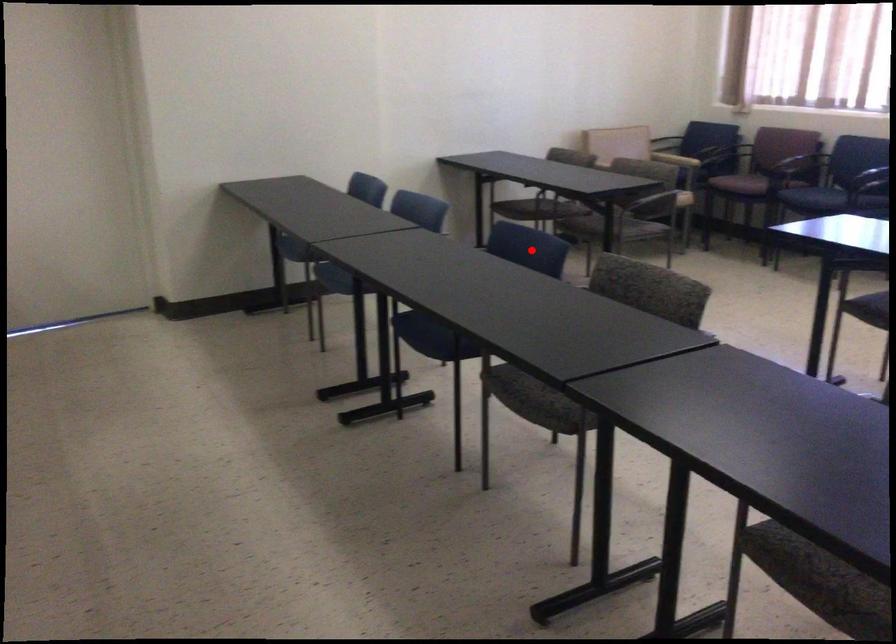
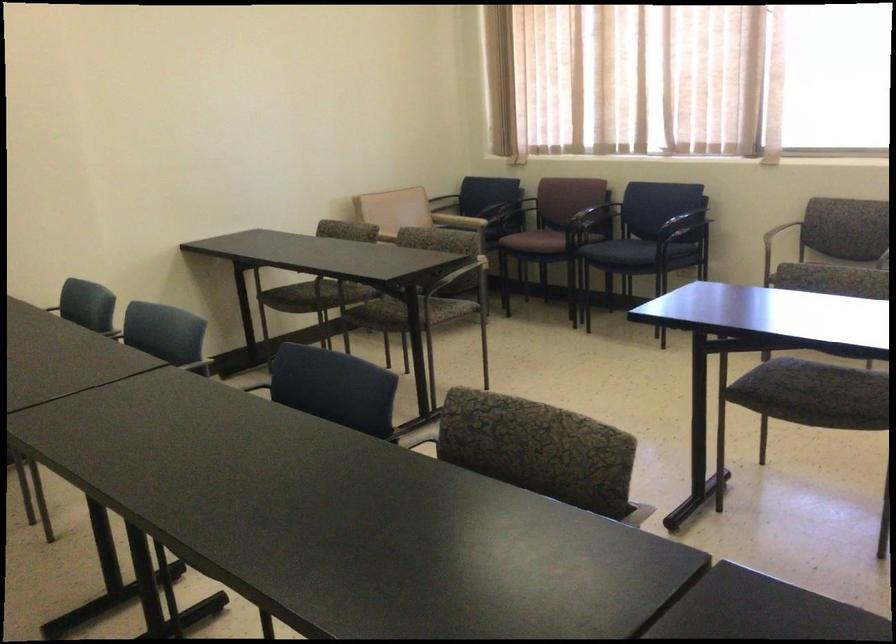
Question: I am providing you with two images of the same scene from different viewpoints. A red point is shown in image1. For the corresponding object point in image2, is it positioned nearer or farther from the camera?

Choices:
 (A) Nearer
 (B) Farther

Answer: (A)